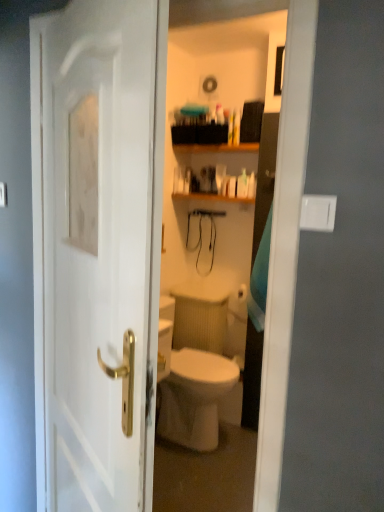
Question: From the image's perspective, is wooden shelf at upper center above white glossy bottle at upper center?

Choices:
 (A) no
 (B) yes

Answer: (B)

Question: From the image's perspective, is wooden shelf at upper center located beneath white glossy bottle at upper center?

Choices:
 (A) yes
 (B) no

Answer: (B)

Question: Is wooden shelf at upper center positioned far away from white glossy bottle at upper center?

Choices:
 (A) yes
 (B) no

Answer: (B)

Question: Considering the relative positions of wooden shelf at upper center and white glossy bottle at upper center in the image provided, is wooden shelf at upper center to the left of white glossy bottle at upper center from the viewer's perspective?

Choices:
 (A) yes
 (B) no

Answer: (A)

Question: From a real-world perspective, does wooden shelf at upper center sit lower than white glossy bottle at upper center?

Choices:
 (A) no
 (B) yes

Answer: (A)

Question: Does wooden shelf at upper center have a lesser width compared to white glossy bottle at upper center?

Choices:
 (A) no
 (B) yes

Answer: (A)

Question: Is wooden shelf at upper center positioned beyond the bounds of white glossy door at center?

Choices:
 (A) yes
 (B) no

Answer: (A)

Question: Considering the relative sizes of wooden shelf at upper center and white glossy door at center in the image provided, is wooden shelf at upper center bigger than white glossy door at center?

Choices:
 (A) yes
 (B) no

Answer: (B)

Question: Can you confirm if wooden shelf at upper center is positioned to the left of white glossy door at center?

Choices:
 (A) yes
 (B) no

Answer: (B)

Question: From a real-world perspective, is wooden shelf at upper center on white glossy door at center?

Choices:
 (A) yes
 (B) no

Answer: (A)

Question: From the image's perspective, would you say wooden shelf at upper center is positioned over white glossy door at center?

Choices:
 (A) yes
 (B) no

Answer: (A)

Question: Is wooden shelf at upper center with white glossy door at center?

Choices:
 (A) no
 (B) yes

Answer: (A)

Question: Considering the relative sizes of white glossy bottle at upper center and wooden shelf at upper center in the image provided, is white glossy bottle at upper center thinner than wooden shelf at upper center?

Choices:
 (A) yes
 (B) no

Answer: (A)